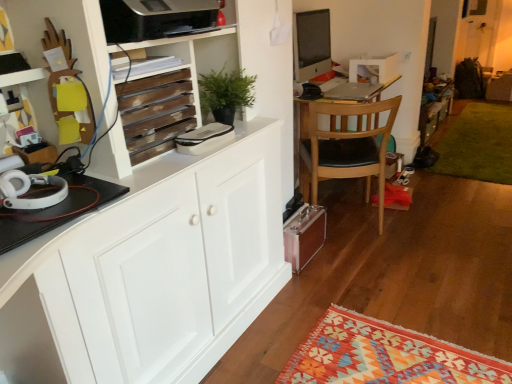
Question: Is light brown wood chair at center facing away from satin black monitor at upper center?

Choices:
 (A) no
 (B) yes

Answer: (A)

Question: From the image's perspective, is light brown wood chair at center over satin black monitor at upper center?

Choices:
 (A) yes
 (B) no

Answer: (B)

Question: Does light brown wood chair at center have a lesser height compared to satin black monitor at upper center?

Choices:
 (A) yes
 (B) no

Answer: (B)

Question: Does light brown wood chair at center turn towards satin black monitor at upper center?

Choices:
 (A) yes
 (B) no

Answer: (A)

Question: Can you confirm if light brown wood chair at center is bigger than satin black monitor at upper center?

Choices:
 (A) no
 (B) yes

Answer: (B)

Question: Relative to wooden slats at upper left, is silver metallic laptop at center in front or behind?

Choices:
 (A) behind
 (B) front

Answer: (A)

Question: Based on their positions, is silver metallic laptop at center located to the left or right of wooden slats at upper left?

Choices:
 (A) right
 (B) left

Answer: (A)

Question: From the image's perspective, is silver metallic laptop at center above or below wooden slats at upper left?

Choices:
 (A) above
 (B) below

Answer: (A)

Question: Considering the positions of point (346, 82) and point (174, 107), is point (346, 82) closer or farther from the camera than point (174, 107)?

Choices:
 (A) farther
 (B) closer

Answer: (A)

Question: Considering the positions of satin black monitor at upper center and silver metallic laptop at center in the image, is satin black monitor at upper center taller or shorter than silver metallic laptop at center?

Choices:
 (A) tall
 (B) short

Answer: (A)

Question: Is satin black monitor at upper center situated inside silver metallic laptop at center or outside?

Choices:
 (A) outside
 (B) inside

Answer: (A)

Question: From the image's perspective, is satin black monitor at upper center positioned above or below silver metallic laptop at center?

Choices:
 (A) above
 (B) below

Answer: (A)

Question: Is satin black monitor at upper center in front of or behind silver metallic laptop at center in the image?

Choices:
 (A) behind
 (B) front

Answer: (A)

Question: Relative to wooden slats at upper left, is light brown wood chair at center in front or behind?

Choices:
 (A) behind
 (B) front

Answer: (A)

Question: Looking at the image, does light brown wood chair at center seem bigger or smaller compared to wooden slats at upper left?

Choices:
 (A) small
 (B) big

Answer: (B)